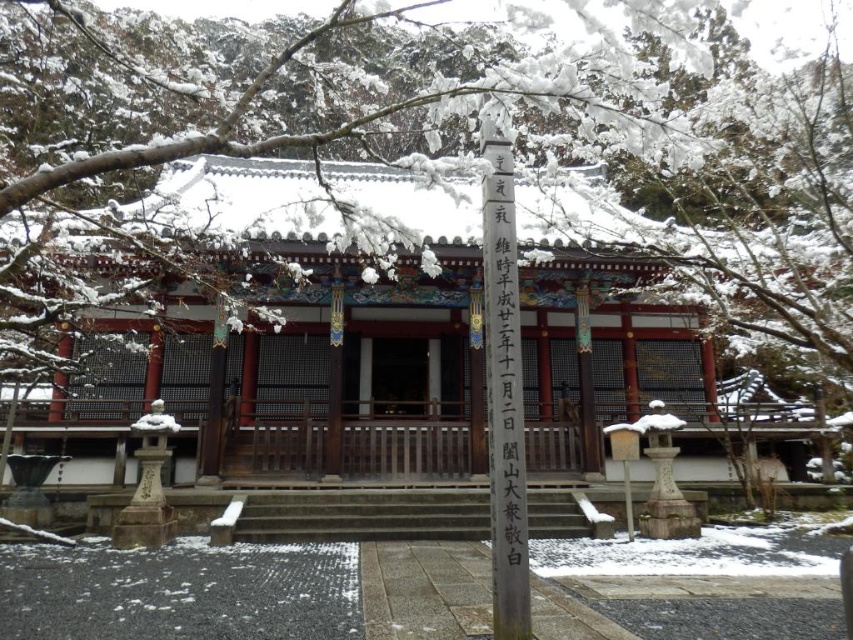
You are standing at the entrance of the temple and want to find the black stone pole at center. According to the temple layout, where should you look relative to the entrance?

The black stone pole at center is located at point 0.617 on the x axis and 0.592 on the y axis relative to the entrance.

From the picture: You are a tourist visiting the temple and want to read the information on the black wood signpost at center. However, you notice the black stone pole at center is blocking your view. Can you still read the signpost without moving the pole?

The black stone pole at center is above the black wood signpost at center, so the pole is blocking the view of the signpost. You cannot read the signpost without moving the pole.